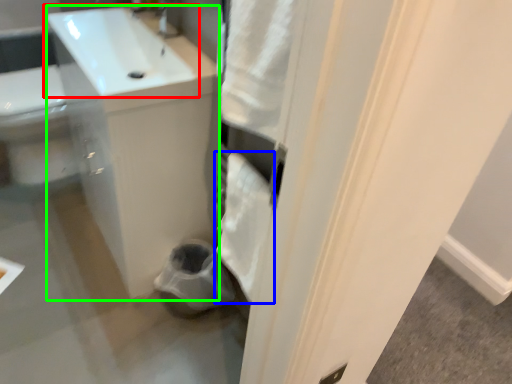
Question: Which object is the closest to the sink (highlighted by a red box)? Choose among these: bath towel (highlighted by a blue box) or counter top (highlighted by a green box).

Choices:
 (A) bath towel
 (B) counter top

Answer: (B)